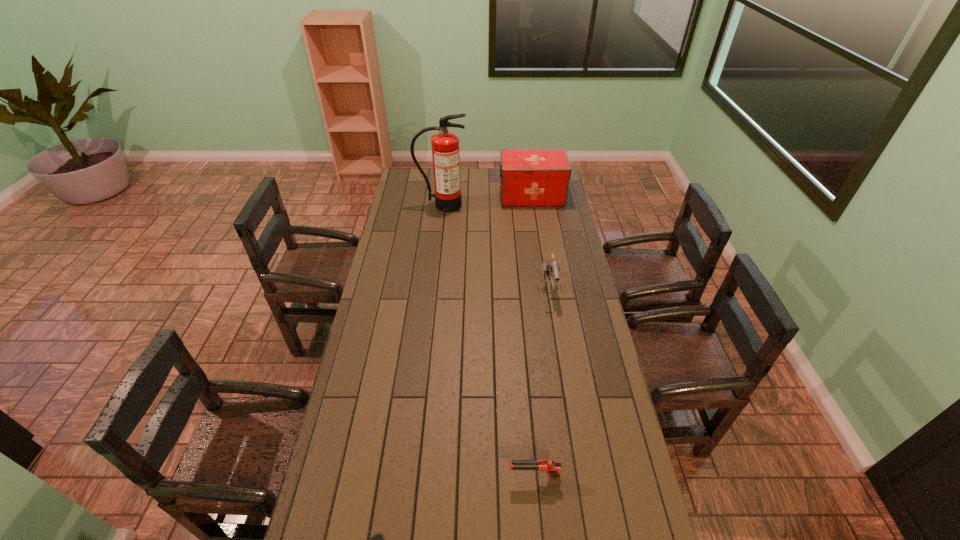
What are the coordinates of `free space at the left edge of the desktop` in the screenshot? It's located at (363, 394).

You are a GUI agent. You are given a task and a screenshot of the screen. Output one action in this format:
    pyautogui.click(x=<x>, y=<y>)
    Task: Click on the free space at the right edge
    
    Given the screenshot: What is the action you would take?
    [x=559, y=300]

Where is `free point between the tallest object and the farther gun`? This screenshot has width=960, height=540. free point between the tallest object and the farther gun is located at coordinates (494, 246).

What are the coordinates of `free spot between the shorter gun and the tallest object` in the screenshot? It's located at (489, 341).

Where is `free spot between the third tallest object and the fire extinguisher`? This screenshot has width=960, height=540. free spot between the third tallest object and the fire extinguisher is located at coordinates (494, 246).

Where is `unoccupied area between the shorter gun and the fourth shortest object`? unoccupied area between the shorter gun and the fourth shortest object is located at coordinates (533, 336).

Choose which object is the fourth nearest neighbor to the shortest object. Please provide its 2D coordinates. Your answer should be formatted as a tuple, i.e. [(x, y)], where the tuple contains the x and y coordinates of a point satisfying the conditions above.

[(528, 177)]

Identify which object is the fourth closest to the second nearest object. Please provide its 2D coordinates. Your answer should be formatted as a tuple, i.e. [(x, y)], where the tuple contains the x and y coordinates of a point satisfying the conditions above.

[(528, 177)]